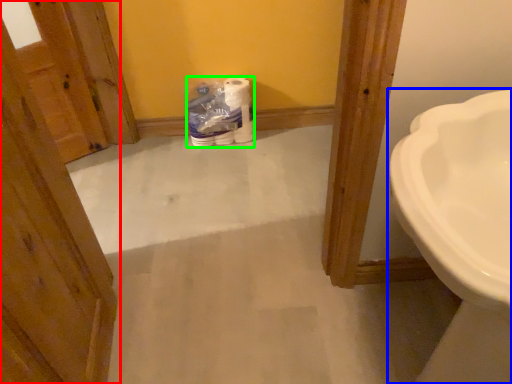
Question: Estimate the real-world distances between objects in this image. Which object is farther from door (highlighted by a red box), sink (highlighted by a blue box) or toilet paper (highlighted by a green box)?

Choices:
 (A) sink
 (B) toilet paper

Answer: (B)